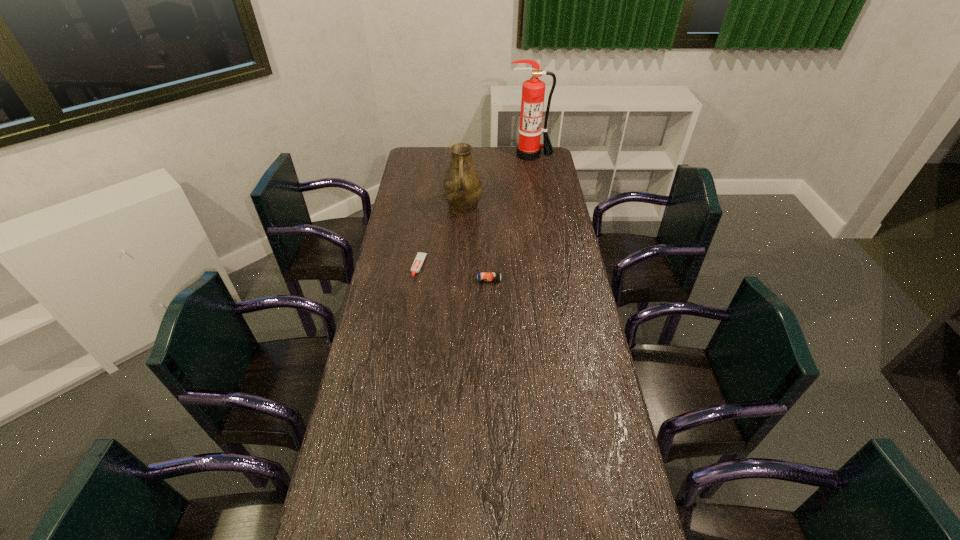
In order to click on vacant space located 0.210m on the back of the leftmost object in this screenshot , I will do `click(425, 225)`.

At what (x,y) coordinates should I click in order to perform the action: click on object present at the far edge. Please return your answer as a coordinate pair (x, y). The width and height of the screenshot is (960, 540). Looking at the image, I should click on (533, 91).

This screenshot has height=540, width=960. Identify the location of object that is at the left edge. (416, 266).

Find the location of a particular element. object that is at the right edge is located at coordinates pos(533,91).

Find the location of a particular element. object at the far right corner is located at coordinates (533, 91).

Identify the location of free space at the far edge. Image resolution: width=960 pixels, height=540 pixels. (493, 164).

At what (x,y) coordinates should I click in order to perform the action: click on free space at the left edge of the desktop. Please return your answer as a coordinate pair (x, y). This screenshot has height=540, width=960. Looking at the image, I should click on (409, 226).

Identify the location of vacant space at the right edge of the desktop. (560, 185).

Identify the location of vacant area between the beer can and the pitcher. (476, 244).

Locate an element on the screen. The width and height of the screenshot is (960, 540). empty space between the third tallest object and the third nearest object is located at coordinates (476, 244).